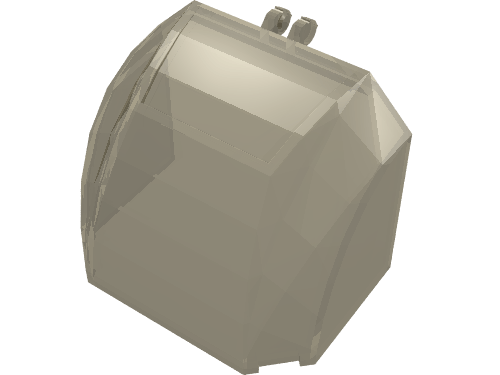
The height and width of the screenshot is (375, 500). Find the location of `left hinge`. left hinge is located at coordinates (304, 18).